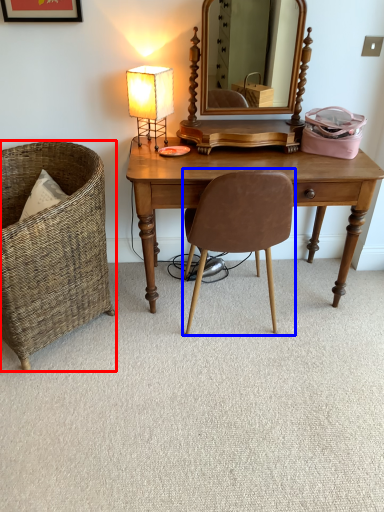
Question: Among these objects, which one is farthest to the camera, chair (highlighted by a red box) or chair (highlighted by a blue box)?

Choices:
 (A) chair
 (B) chair

Answer: (B)